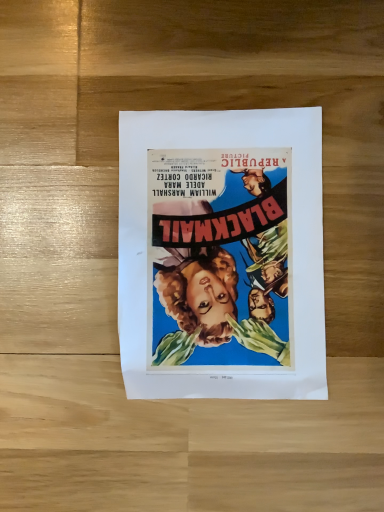
The width and height of the screenshot is (384, 512). What are the coordinates of `matte paper poster at center` in the screenshot? It's located at (221, 254).

The width and height of the screenshot is (384, 512). What do you see at coordinates (221, 254) in the screenshot?
I see `matte paper poster at center` at bounding box center [221, 254].

What is the approximate height of matte paper poster at center?

matte paper poster at center is 1.07 inches tall.

Find the location of `matte paper poster at center`. matte paper poster at center is located at coordinates (221, 254).